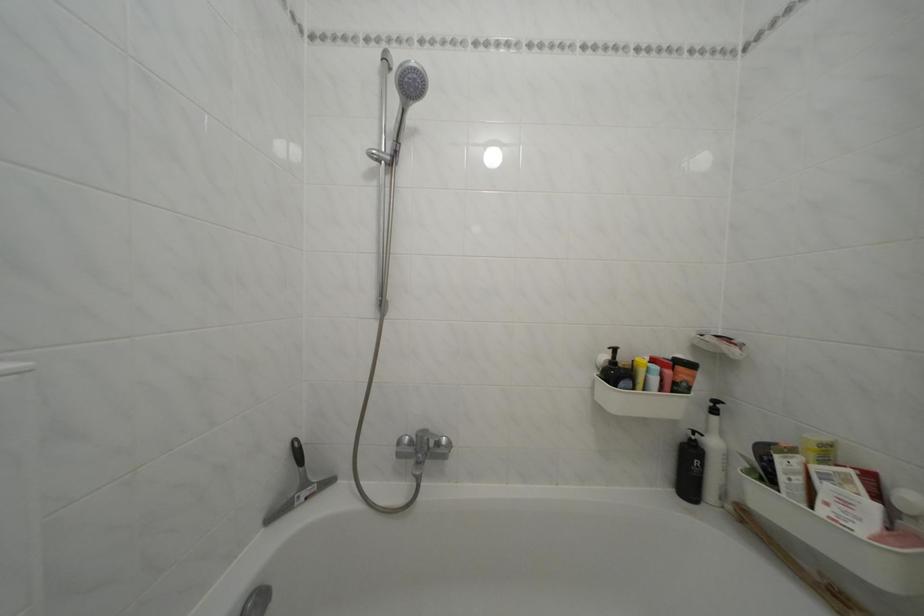
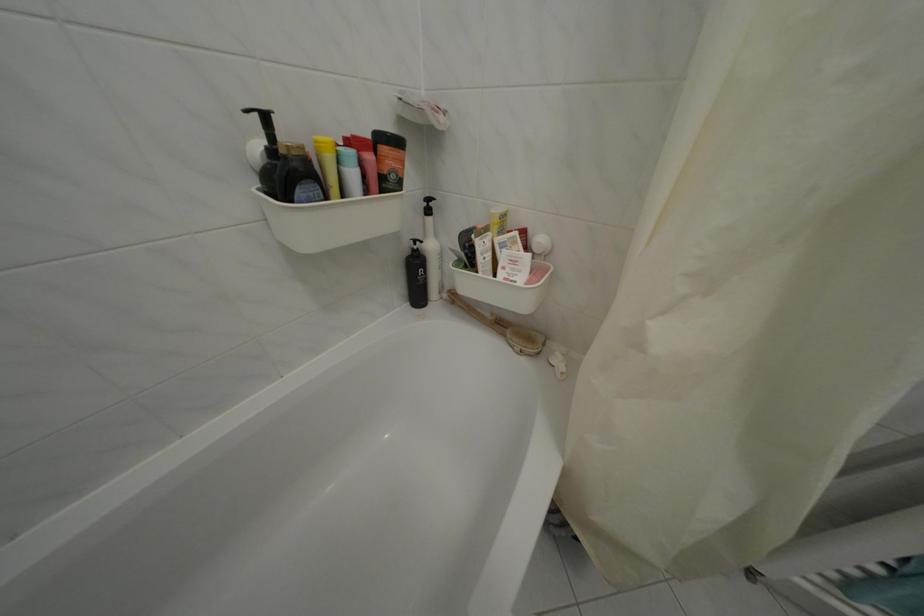
First-person continuous shooting, in which direction is the camera rotating?

The rotation direction of the camera is right-down.